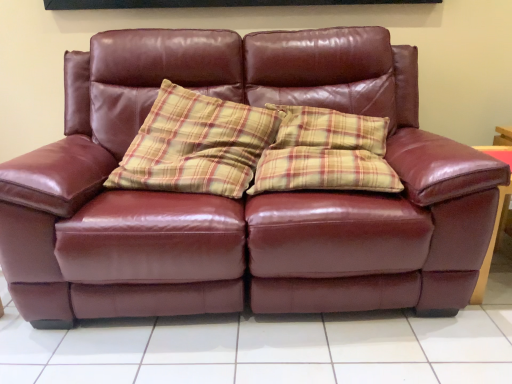
At what (x,y) coordinates should I click in order to perform the action: click on brown leather couch at center. Please return your answer as a coordinate pair (x, y). The image size is (512, 384). Looking at the image, I should click on (263, 349).

Image resolution: width=512 pixels, height=384 pixels. Describe the element at coordinates (263, 349) in the screenshot. I see `brown leather couch at center` at that location.

The width and height of the screenshot is (512, 384). Identify the location of brown leather couch at center. point(263,349).